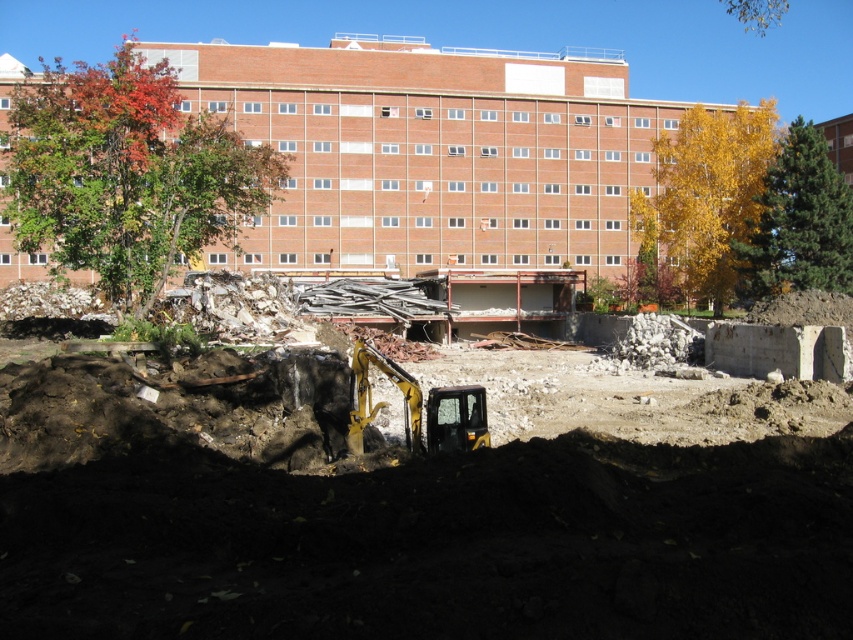
Which is in front, point (99, 282) or point (846, 276)?

Point (846, 276)

Who is higher up, autumn leaves at upper left or yellow-green foliage at upper right?

autumn leaves at upper left is above.

Which is in front, point (115, 186) or point (819, 161)?

Point (115, 186) is more forward.

I want to click on autumn leaves at upper left, so click(126, 173).

Who is positioned more to the left, yellow leafy tree at right or yellow metallic excavator at center?

yellow metallic excavator at center

Does yellow leafy tree at right lie in front of yellow metallic excavator at center?

No, it is not.

The height and width of the screenshot is (640, 853). Identify the location of yellow leafy tree at right. (706, 193).

Identify the location of yellow leafy tree at right. (706, 193).

Can you confirm if yellow-green foliage at upper right is taller than yellow metallic excavator at center?

Correct, yellow-green foliage at upper right is much taller as yellow metallic excavator at center.

Who is positioned more to the right, yellow-green foliage at upper right or yellow metallic excavator at center?

From the viewer's perspective, yellow-green foliage at upper right appears more on the right side.

Is point (808, 276) closer to viewer compared to point (466, 419)?

That is False.

You are a GUI agent. You are given a task and a screenshot of the screen. Output one action in this format:
    pyautogui.click(x=<x>, y=<y>)
    Task: Click on the yellow-green foliage at upper right
    The height and width of the screenshot is (640, 853).
    Given the screenshot: What is the action you would take?
    pyautogui.click(x=799, y=221)